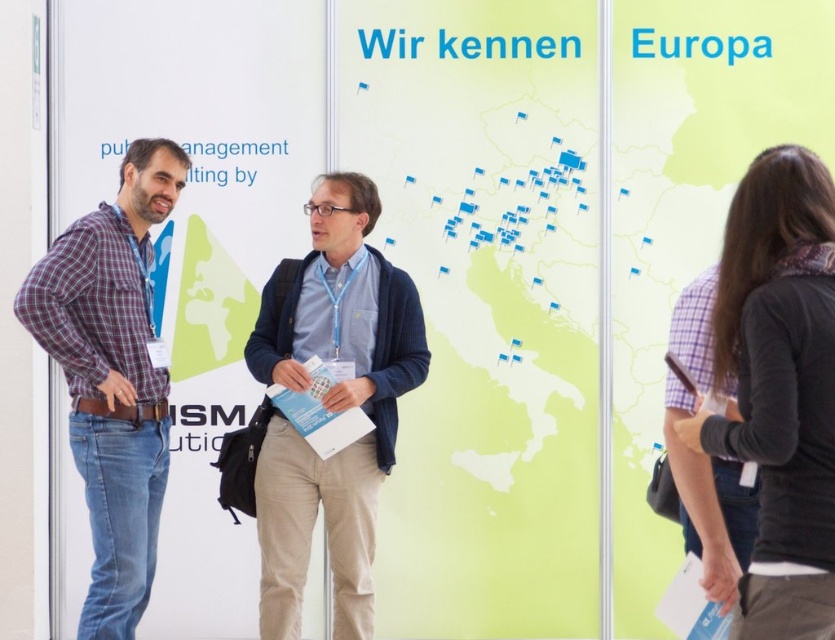
Question: Among these points, which one is farthest from the camera?

Choices:
 (A) (782, 499)
 (B) (315, 188)
 (C) (129, 312)

Answer: (B)

Question: Which object is closer to the camera taking this photo?

Choices:
 (A) black sweater at right
 (B) plaid cotton shirt at left

Answer: (A)

Question: Does black sweater at right appear under blue corduroy sweater at center?

Choices:
 (A) yes
 (B) no

Answer: (B)

Question: Is black sweater at right below blue corduroy sweater at center?

Choices:
 (A) no
 (B) yes

Answer: (A)

Question: Is black sweater at right bigger than plaid cotton shirt at left?

Choices:
 (A) no
 (B) yes

Answer: (A)

Question: Which point is closer to the camera taking this photo?

Choices:
 (A) (419, 339)
 (B) (778, 195)
 (C) (152, 557)

Answer: (B)